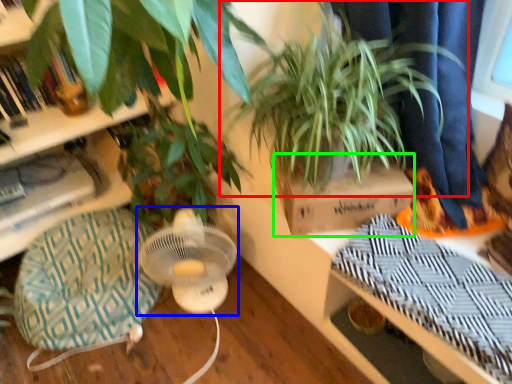
Question: Estimate the real-world distances between objects in this image. Which object is farther from houseplant (highlighted by a red box), mechanical fan (highlighted by a blue box) or cardboard box (highlighted by a green box)?

Choices:
 (A) mechanical fan
 (B) cardboard box

Answer: (A)